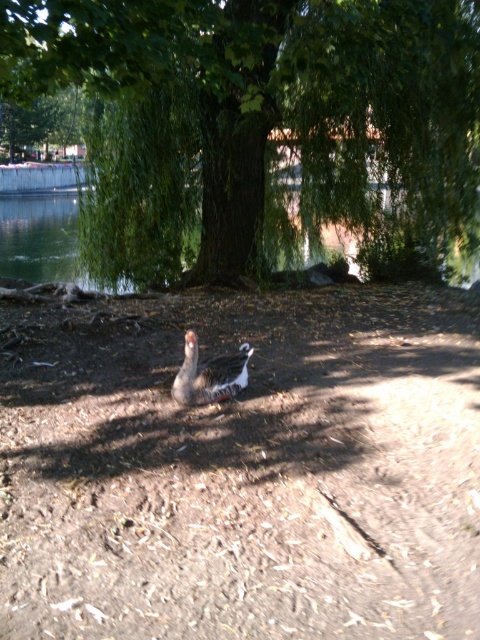
You are a bird flying over the tranquil outdoor scene. You need to land on the closest object between the green leafy tree at center and the green leafy water at center. Which one should you choose?

The green leafy tree at center is 19.95 meters away from the green leafy water at center. Since you want to land on the closest object, you can choose either one because they are the same distance apart from your current position.

Consider the image. You are a small toy boat that is 10 cm long. You want to sail from the green leafy water at center to the speckled gray duck at center. Can you fit through the space between them?

The green leafy water at center might be wider than speckled gray duck at center, so the space between them could accommodate the 10 cm boat. However, since the exact width isn not specified, there is uncertainty. Proceed with caution.